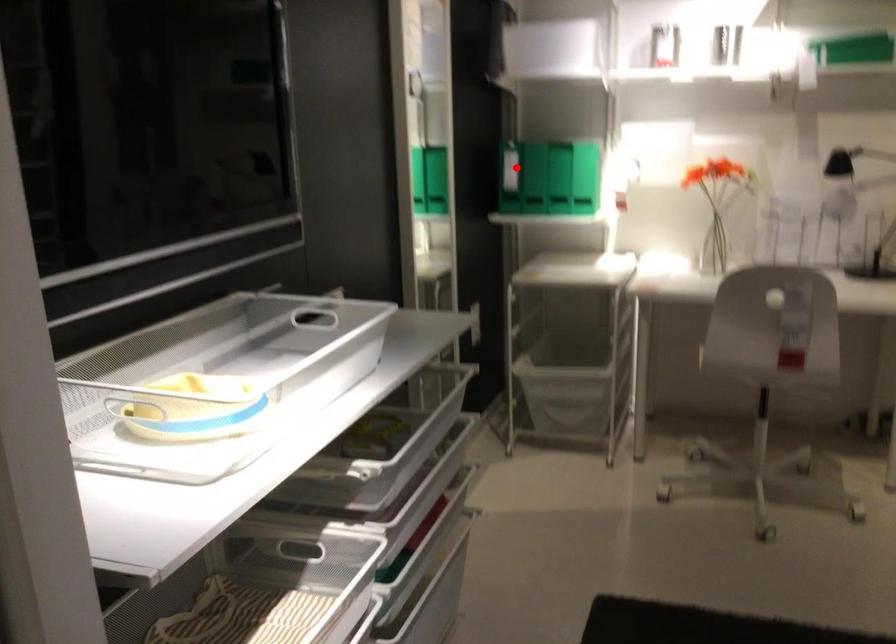
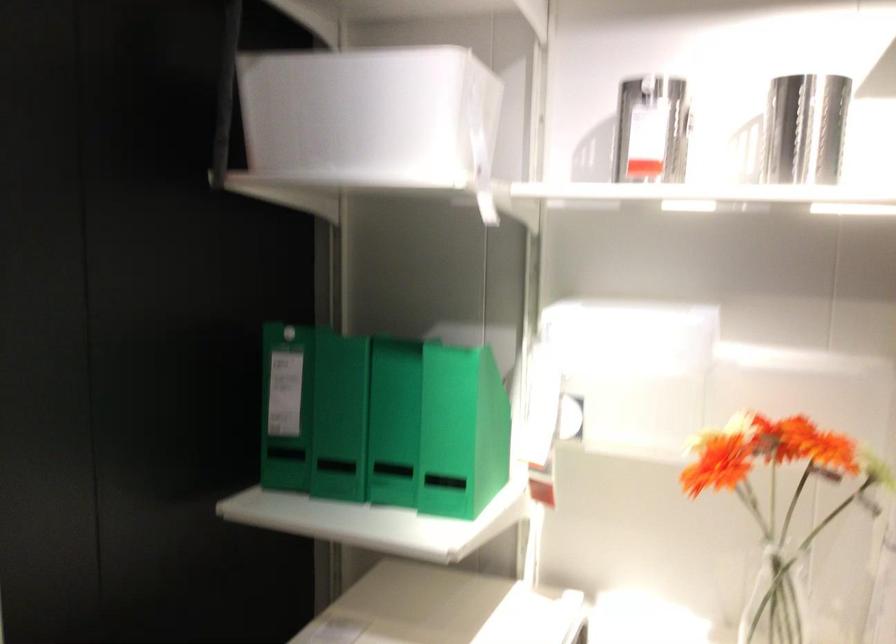
Question: I am providing you with two images of the same scene from different viewpoints. In image1, a red point is highlighted. Considering the same 3D point in image2, which of the following is correct?

Choices:
 (A) It is closer
 (B) It is farther

Answer: (A)